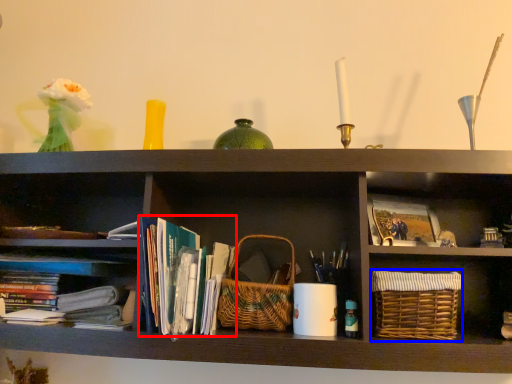
Question: Which object appears closest to the camera in this image, book (highlighted by a red box) or basket (highlighted by a blue box)?

Choices:
 (A) book
 (B) basket

Answer: (A)